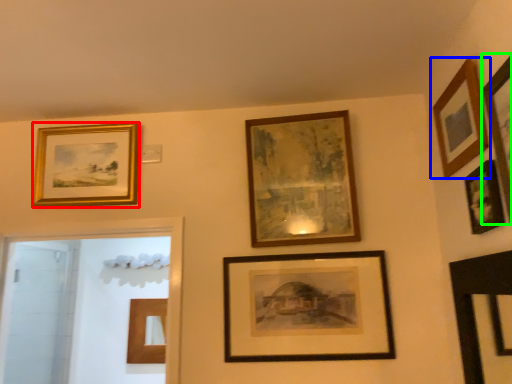
Question: Estimate the real-world distances between objects in this image. Which object is farther from picture frame (highlighted by a red box), picture frame (highlighted by a blue box) or picture frame (highlighted by a green box)?

Choices:
 (A) picture frame
 (B) picture frame

Answer: (B)